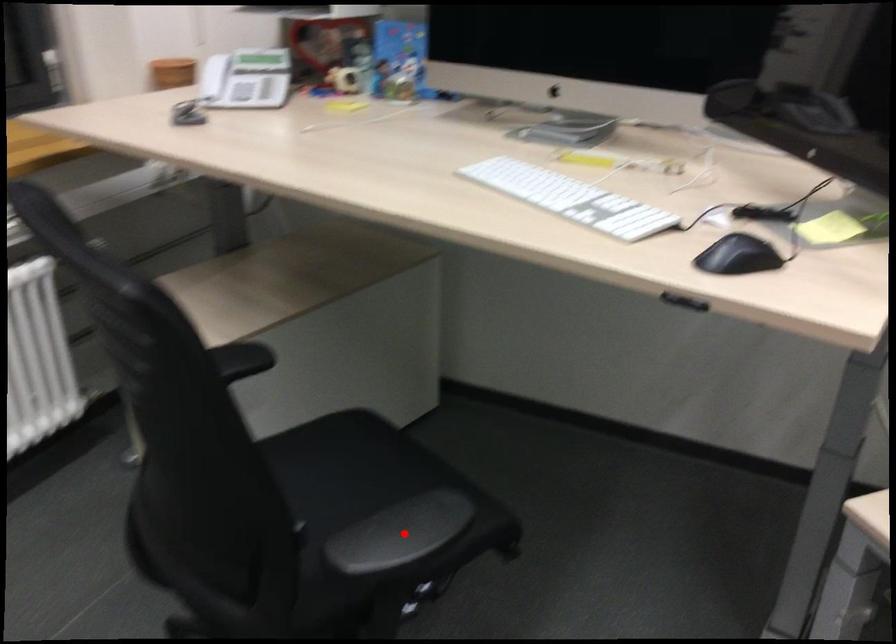
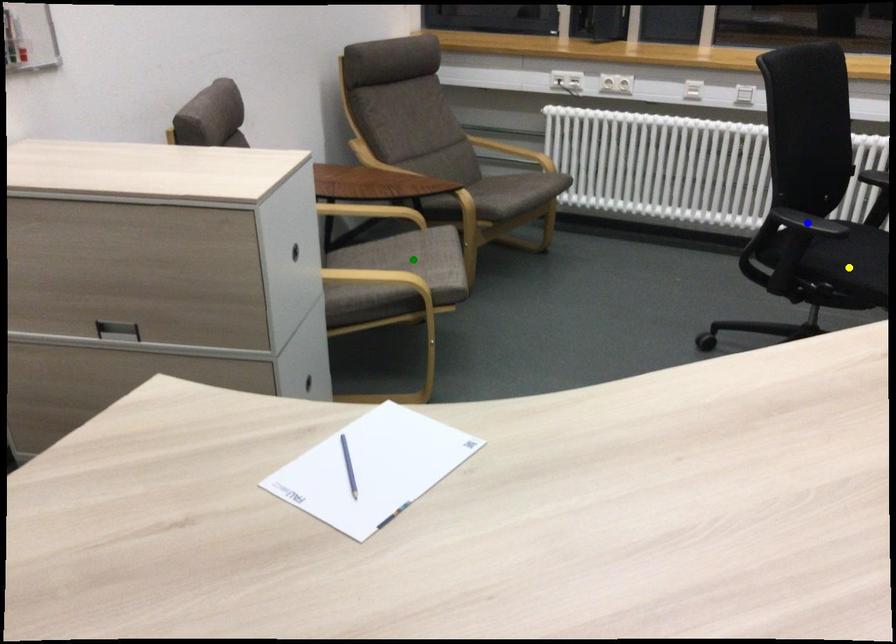
Question: I am providing you with two images of the same scene from different viewpoints. A red point is marked on the first image. You are given multiple points on the second image. Which mark in image 2 goes with the point in image 1?

Choices:
 (A) green point
 (B) yellow point
 (C) blue point

Answer: (C)